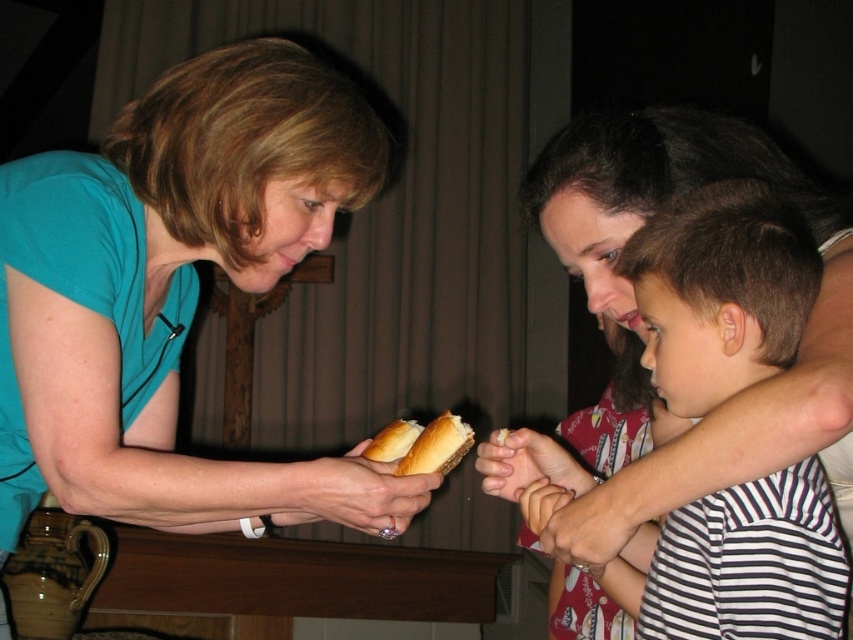
Question: Is striped cotton shirt at center below golden bread roll at center?

Choices:
 (A) yes
 (B) no

Answer: (B)

Question: Can you confirm if matte teal shirt at left is smaller than golden bread roll at center?

Choices:
 (A) no
 (B) yes

Answer: (A)

Question: Which point is closer to the camera?

Choices:
 (A) golden bread roll at center
 (B) striped cotton shirt at center
 (C) matte teal shirt at left

Answer: (B)

Question: Which object is the farthest from the golden bread roll at center?

Choices:
 (A) matte teal shirt at left
 (B) striped cotton shirt at center

Answer: (B)

Question: Which point is farther to the camera?

Choices:
 (A) matte teal shirt at left
 (B) striped cotton shirt at center
 (C) golden bread roll at center

Answer: (C)

Question: Is the position of matte teal shirt at left less distant than that of striped cotton shirt at center?

Choices:
 (A) yes
 (B) no

Answer: (B)